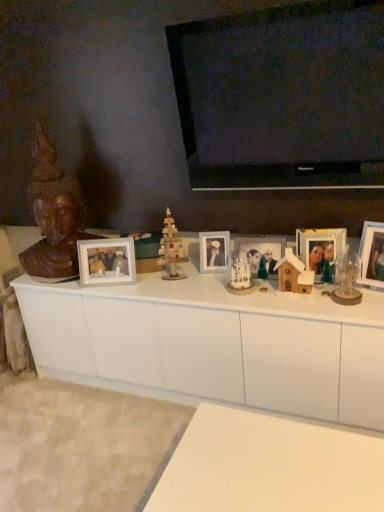
Question: Does matte glass photo frame at center right, which is the 2th picture frame from right to left, have a greater height compared to wooden photo frame at right, arranged as the 5th picture frame when viewed from the left?

Choices:
 (A) no
 (B) yes

Answer: (A)

Question: From a real-world perspective, is matte glass photo frame at center right, which is the 2th picture frame from right to left, over wooden photo frame at right, the 1th picture frame when ordered from right to left?

Choices:
 (A) no
 (B) yes

Answer: (A)

Question: Is the position of matte glass photo frame at center right, which is the 2th picture frame from right to left, more distant than that of wooden photo frame at right, the 1th picture frame when ordered from right to left?

Choices:
 (A) no
 (B) yes

Answer: (B)

Question: From a real-world perspective, is matte glass photo frame at center right, the 4th picture frame viewed from the left, physically below wooden photo frame at right, the 1th picture frame when ordered from right to left?

Choices:
 (A) yes
 (B) no

Answer: (A)

Question: Is there a large distance between matte glass photo frame at center right, the 4th picture frame viewed from the left, and wooden photo frame at right, the 1th picture frame when ordered from right to left?

Choices:
 (A) no
 (B) yes

Answer: (A)

Question: Is matte glass photo frame at center right, which is the 2th picture frame from right to left, outside wooden photo frame at right, arranged as the 5th picture frame when viewed from the left?

Choices:
 (A) no
 (B) yes

Answer: (B)

Question: Is white matte picture frame at center, marked as the fifth picture frame in a right-to-left arrangement, to the right of white matte cabinet at center from the viewer's perspective?

Choices:
 (A) no
 (B) yes

Answer: (A)

Question: Considering the relative sizes of white matte picture frame at center, marked as the fifth picture frame in a right-to-left arrangement, and white matte cabinet at center in the image provided, is white matte picture frame at center, marked as the fifth picture frame in a right-to-left arrangement, smaller than white matte cabinet at center?

Choices:
 (A) no
 (B) yes

Answer: (B)

Question: From a real-world perspective, does white matte picture frame at center, placed as the 1th picture frame when sorted from left to right, sit lower than white matte cabinet at center?

Choices:
 (A) no
 (B) yes

Answer: (A)

Question: Is white matte picture frame at center, marked as the fifth picture frame in a right-to-left arrangement, closer to the viewer compared to white matte cabinet at center?

Choices:
 (A) yes
 (B) no

Answer: (B)

Question: Can you confirm if white matte picture frame at center, marked as the fifth picture frame in a right-to-left arrangement, is shorter than white matte cabinet at center?

Choices:
 (A) yes
 (B) no

Answer: (A)

Question: Is white matte picture frame at center, marked as the fifth picture frame in a right-to-left arrangement, aimed at white matte cabinet at center?

Choices:
 (A) no
 (B) yes

Answer: (A)

Question: Considering the relative positions of matte wooden picture frame at center, acting as the third picture frame starting from the right, and white ceramic snowman at center, the 2th toy from the right, in the image provided, is matte wooden picture frame at center, acting as the third picture frame starting from the right, to the left of white ceramic snowman at center, the 2th toy from the right, from the viewer's perspective?

Choices:
 (A) no
 (B) yes

Answer: (A)